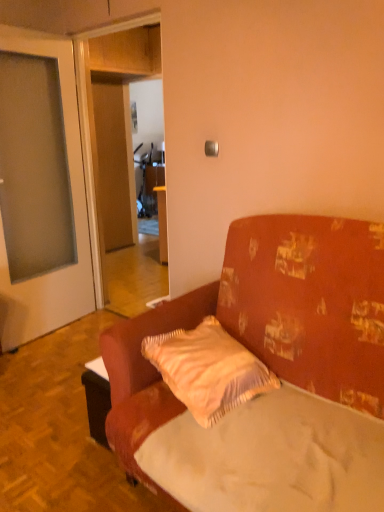
Question: From the image's perspective, is light beige textured pillow at center beneath white fabric mattress at center?

Choices:
 (A) no
 (B) yes

Answer: (A)

Question: From a real-world perspective, is light beige textured pillow at center beneath white fabric mattress at center?

Choices:
 (A) yes
 (B) no

Answer: (B)

Question: Can you confirm if light beige textured pillow at center is taller than white fabric mattress at center?

Choices:
 (A) yes
 (B) no

Answer: (A)

Question: Is light beige textured pillow at center oriented away from white fabric mattress at center?

Choices:
 (A) no
 (B) yes

Answer: (A)

Question: Considering the relative sizes of light beige textured pillow at center and white fabric mattress at center in the image provided, is light beige textured pillow at center shorter than white fabric mattress at center?

Choices:
 (A) yes
 (B) no

Answer: (B)

Question: Would you say white fabric mattress at center is to the left or to the right of light beige textured pillow at center in the picture?

Choices:
 (A) left
 (B) right

Answer: (B)

Question: From the image's perspective, relative to light beige textured pillow at center, is white fabric mattress at center above or below?

Choices:
 (A) below
 (B) above

Answer: (A)

Question: From a real-world perspective, is white fabric mattress at center positioned above or below light beige textured pillow at center?

Choices:
 (A) above
 (B) below

Answer: (B)

Question: In terms of width, does white fabric mattress at center look wider or thinner when compared to light beige textured pillow at center?

Choices:
 (A) thin
 (B) wide

Answer: (B)

Question: Is point (334, 264) positioned closer to the camera than point (155, 335)?

Choices:
 (A) closer
 (B) farther

Answer: (A)

Question: Is textured fabric couch at center in front of or behind light beige textured pillow at center in the image?

Choices:
 (A) behind
 (B) front

Answer: (B)

Question: In terms of height, does textured fabric couch at center look taller or shorter compared to light beige textured pillow at center?

Choices:
 (A) tall
 (B) short

Answer: (A)

Question: Considering the positions of textured fabric couch at center and light beige textured pillow at center in the image, is textured fabric couch at center bigger or smaller than light beige textured pillow at center?

Choices:
 (A) big
 (B) small

Answer: (A)

Question: From the image's perspective, is light beige textured pillow at center located above or below white fabric mattress at center?

Choices:
 (A) above
 (B) below

Answer: (A)

Question: Is light beige textured pillow at center taller or shorter than white fabric mattress at center?

Choices:
 (A) tall
 (B) short

Answer: (A)